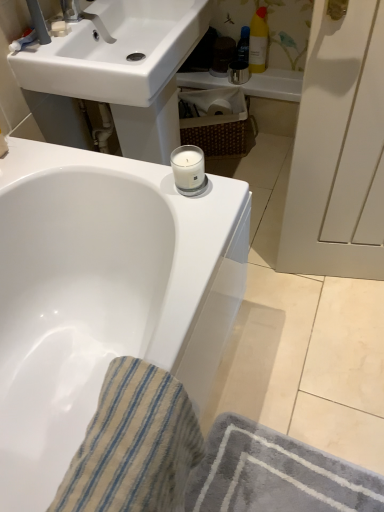
Describe the element at coordinates (103, 294) in the screenshot. I see `white glossy bathtub at upper center` at that location.

Describe the element at coordinates (73, 11) in the screenshot. I see `matte white faucet at upper left` at that location.

Measure the distance between beige striped cloth at lower left and camera.

They are 61.15 centimeters apart.

This screenshot has width=384, height=512. I want to click on white glossy bathtub at upper center, so click(103, 294).

Considering the positions of objects beige striped cloth at lower left and matte white faucet at upper left in the image provided, who is more to the right, beige striped cloth at lower left or matte white faucet at upper left?

beige striped cloth at lower left.

Between beige striped cloth at lower left and matte white faucet at upper left, which one has smaller width?

matte white faucet at upper left.

From the image's perspective, which object appears higher, beige striped cloth at lower left or matte white faucet at upper left?

matte white faucet at upper left, from the image's perspective.

From their relative heights in the image, would you say beige striped cloth at lower left is taller or shorter than matte white faucet at upper left?

Considering their sizes, beige striped cloth at lower left has more height than matte white faucet at upper left.

Is translucent plastic bottle at upper right, positioned as the second toiletry in right-to-left order, at the back of yellow matte bottle at upper right, which appears as the 1th toiletry when viewed from the right?

No.

Is yellow matte bottle at upper right, which appears as the 1th toiletry when viewed from the right, next to translucent plastic bottle at upper right, marked as the 1th toiletry in a left-to-right arrangement, and touching it?

Yes, yellow matte bottle at upper right, which appears as the 1th toiletry when viewed from the right, is touching translucent plastic bottle at upper right, marked as the 1th toiletry in a left-to-right arrangement.

Is yellow matte bottle at upper right, which ranks as the 2th toiletry in left-to-right order, bigger than translucent plastic bottle at upper right, marked as the 1th toiletry in a left-to-right arrangement?

Yes, yellow matte bottle at upper right, which ranks as the 2th toiletry in left-to-right order, is bigger than translucent plastic bottle at upper right, marked as the 1th toiletry in a left-to-right arrangement.

Which object is positioned more to the right, yellow matte bottle at upper right, which ranks as the 2th toiletry in left-to-right order, or translucent plastic bottle at upper right, positioned as the second toiletry in right-to-left order?

yellow matte bottle at upper right, which ranks as the 2th toiletry in left-to-right order.

Looking at this image, would you say translucent plastic bottle at upper right, positioned as the second toiletry in right-to-left order, is part of white glossy bathtub at upper center's contents?

No, translucent plastic bottle at upper right, positioned as the second toiletry in right-to-left order, is not surrounded by white glossy bathtub at upper center.

In the image, is white glossy bathtub at upper center positioned in front of or behind translucent plastic bottle at upper right, marked as the 1th toiletry in a left-to-right arrangement?

Clearly, white glossy bathtub at upper center is in front of translucent plastic bottle at upper right, marked as the 1th toiletry in a left-to-right arrangement.

Does white glossy bathtub at upper center turn towards translucent plastic bottle at upper right, positioned as the second toiletry in right-to-left order?

No, white glossy bathtub at upper center is not aimed at translucent plastic bottle at upper right, positioned as the second toiletry in right-to-left order.

Who is smaller, white glossy bathtub at upper center or translucent plastic bottle at upper right, marked as the 1th toiletry in a left-to-right arrangement?

Smaller between the two is translucent plastic bottle at upper right, marked as the 1th toiletry in a left-to-right arrangement.

From the image's perspective, who appears lower, white glossy sink at upper center or translucent plastic bottle at upper right, marked as the 1th toiletry in a left-to-right arrangement?

white glossy sink at upper center appears lower in the image.

Is white glossy sink at upper center further to the viewer compared to translucent plastic bottle at upper right, positioned as the second toiletry in right-to-left order?

No.

Considering the sizes of white glossy sink at upper center and translucent plastic bottle at upper right, positioned as the second toiletry in right-to-left order, in the image, is white glossy sink at upper center taller or shorter than translucent plastic bottle at upper right, positioned as the second toiletry in right-to-left order,?

Considering their sizes, white glossy sink at upper center has more height than translucent plastic bottle at upper right, positioned as the second toiletry in right-to-left order.

How many degrees apart are the facing directions of white glossy sink at upper center and translucent plastic bottle at upper right, marked as the 1th toiletry in a left-to-right arrangement?

There is a 88.4-degree angle between the facing directions of white glossy sink at upper center and translucent plastic bottle at upper right, marked as the 1th toiletry in a left-to-right arrangement.

Is beige striped cloth at lower left aimed at woven brown basket at center?

No.

Between point (79, 465) and point (186, 132), which one is positioned behind?

Point (186, 132)

In terms of width, does beige striped cloth at lower left look wider or thinner when compared to woven brown basket at center?

In the image, beige striped cloth at lower left appears to be wider than woven brown basket at center.

Looking at this image, which is correct: beige striped cloth at lower left is inside woven brown basket at center, or outside of it?

beige striped cloth at lower left lies outside woven brown basket at center.

Considering the relative sizes of translucent plastic bottle at upper right, marked as the 1th toiletry in a left-to-right arrangement, and white glossy bathtub at upper center in the image provided, is translucent plastic bottle at upper right, marked as the 1th toiletry in a left-to-right arrangement, taller than white glossy bathtub at upper center?

No.

This screenshot has height=512, width=384. Identify the location of the 1st toiletry directly above the white glossy bathtub at upper center (from a real-world perspective). (243, 45).

Do you think translucent plastic bottle at upper right, positioned as the second toiletry in right-to-left order, is within white glossy bathtub at upper center, or outside of it?

translucent plastic bottle at upper right, positioned as the second toiletry in right-to-left order, cannot be found inside white glossy bathtub at upper center.

Can you confirm if translucent plastic bottle at upper right, marked as the 1th toiletry in a left-to-right arrangement, is thinner than white glossy bathtub at upper center?

Yes.

Consider the image. How different are the orientations of beige striped cloth at lower left and translucent plastic bottle at upper right, positioned as the second toiletry in right-to-left order, in degrees?

The angular difference between beige striped cloth at lower left and translucent plastic bottle at upper right, positioned as the second toiletry in right-to-left order, is 89.8 degrees.

Considering the sizes of beige striped cloth at lower left and translucent plastic bottle at upper right, marked as the 1th toiletry in a left-to-right arrangement, in the image, is beige striped cloth at lower left wider or thinner than translucent plastic bottle at upper right, marked as the 1th toiletry in a left-to-right arrangement,?

beige striped cloth at lower left is wider than translucent plastic bottle at upper right, marked as the 1th toiletry in a left-to-right arrangement.

Is beige striped cloth at lower left not close to translucent plastic bottle at upper right, marked as the 1th toiletry in a left-to-right arrangement?

Yes, beige striped cloth at lower left is far from translucent plastic bottle at upper right, marked as the 1th toiletry in a left-to-right arrangement.

Consider the image. Would you say beige striped cloth at lower left is to the left or to the right of translucent plastic bottle at upper right, marked as the 1th toiletry in a left-to-right arrangement, in the picture?

In the image, beige striped cloth at lower left appears on the left side of translucent plastic bottle at upper right, marked as the 1th toiletry in a left-to-right arrangement.

Locate an element on the screen. This screenshot has height=512, width=384. plumbing fixture on the left of beige striped cloth at lower left is located at coordinates (73, 11).

Find the location of `toiletry located underneath the yellow matte bottle at upper right, which appears as the 1th toiletry when viewed from the right (from a real-world perspective)`. toiletry located underneath the yellow matte bottle at upper right, which appears as the 1th toiletry when viewed from the right (from a real-world perspective) is located at coordinates (243, 45).

Looking at the image, which one is located closer to yellow matte bottle at upper right, which appears as the 1th toiletry when viewed from the right, woven brown basket at center or white glossy sink at upper center?

woven brown basket at center.

Looking at the image, which one is located closer to white glossy sink at upper center, yellow matte bottle at upper right, which appears as the 1th toiletry when viewed from the right, or woven brown basket at center?

Based on the image, woven brown basket at center appears to be nearer to white glossy sink at upper center.

Considering their positions, is matte white faucet at upper left positioned closer to yellow matte bottle at upper right, which appears as the 1th toiletry when viewed from the right, than beige striped cloth at lower left?

The object closer to yellow matte bottle at upper right, which appears as the 1th toiletry when viewed from the right, is matte white faucet at upper left.

From the image, which object appears to be nearer to beige striped cloth at lower left, matte white faucet at upper left or yellow matte bottle at upper right, which ranks as the 2th toiletry in left-to-right order?

The object closer to beige striped cloth at lower left is matte white faucet at upper left.

When comparing their distances from white glossy bathtub at upper center, does woven brown basket at center or beige striped cloth at lower left seem further?

woven brown basket at center is positioned further to the anchor white glossy bathtub at upper center.

Looking at the image, which one is located further to yellow matte bottle at upper right, which ranks as the 2th toiletry in left-to-right order, beige striped cloth at lower left or white glossy sink at upper center?

beige striped cloth at lower left lies further to yellow matte bottle at upper right, which ranks as the 2th toiletry in left-to-right order, than the other object.

When comparing their distances from white glossy sink at upper center, does woven brown basket at center or white glossy bathtub at upper center seem further?

woven brown basket at center lies further to white glossy sink at upper center than the other object.

When comparing their distances from white glossy bathtub at upper center, does woven brown basket at center or translucent plastic bottle at upper right, marked as the 1th toiletry in a left-to-right arrangement, seem further?

translucent plastic bottle at upper right, marked as the 1th toiletry in a left-to-right arrangement, lies further to white glossy bathtub at upper center than the other object.

Locate an element on the screen. basket between white glossy sink at upper center and translucent plastic bottle at upper right, positioned as the second toiletry in right-to-left order, in the front-back direction is located at coordinates (214, 120).

The height and width of the screenshot is (512, 384). Identify the location of sink between beige striped cloth at lower left and translucent plastic bottle at upper right, marked as the 1th toiletry in a left-to-right arrangement, along the z-axis. (124, 67).

Identify the location of toiletry between matte white faucet at upper left and woven brown basket at center along the z-axis. This screenshot has height=512, width=384. (258, 41).

Where is `toiletry between white glossy bathtub at upper center and translucent plastic bottle at upper right, positioned as the second toiletry in right-to-left order, along the z-axis`? toiletry between white glossy bathtub at upper center and translucent plastic bottle at upper right, positioned as the second toiletry in right-to-left order, along the z-axis is located at coordinates (258, 41).